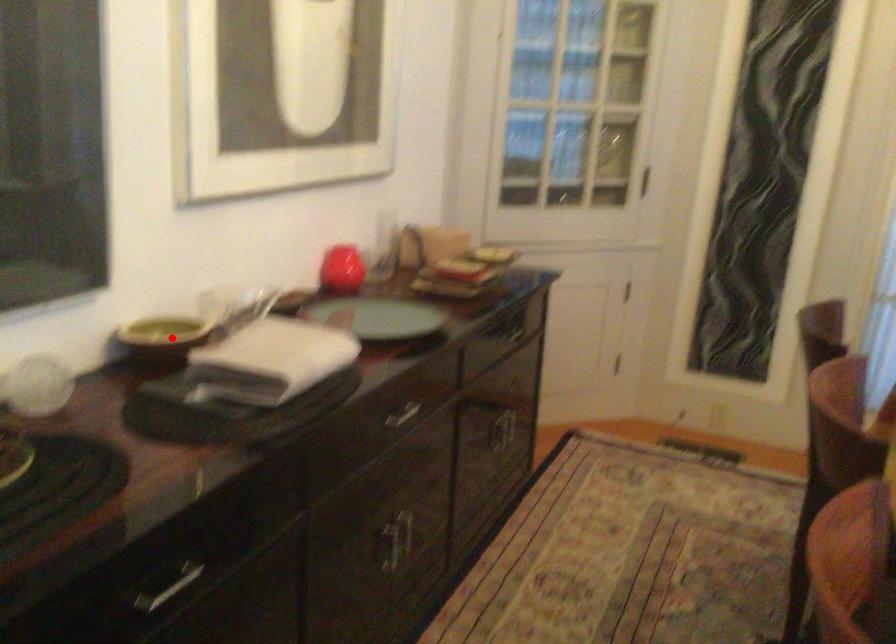
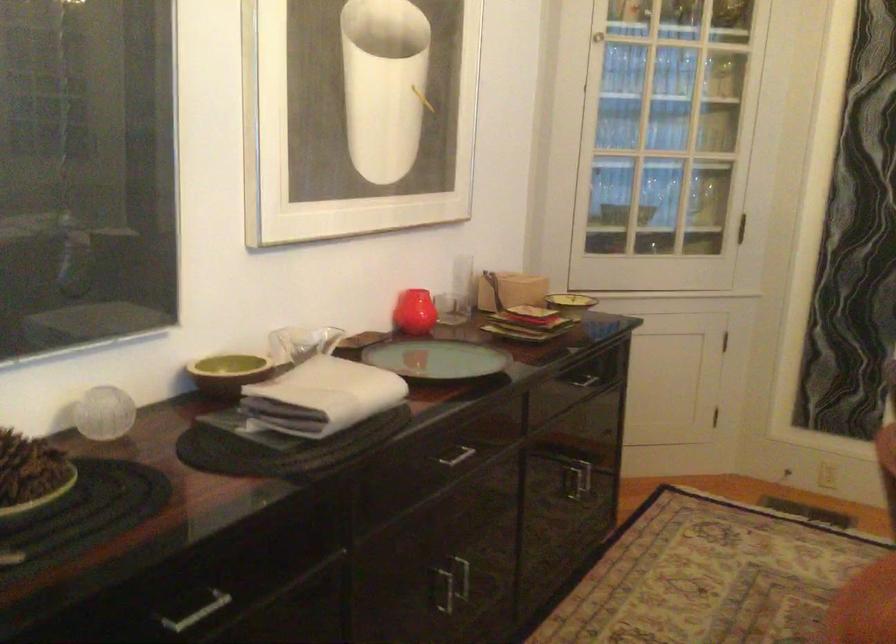
Where in the second image is the point corresponding to the highlighted location from the first image?

(228, 373)